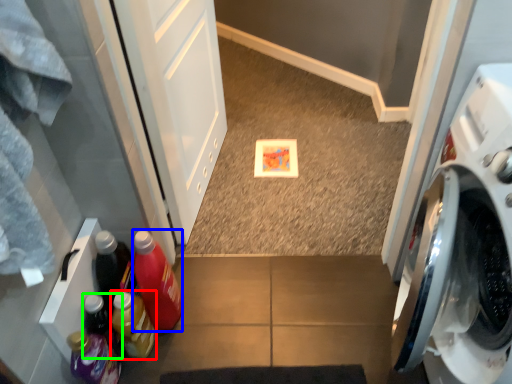
Question: Which object is positioned closest to bottle (highlighted by a red box)? Select from bottle (highlighted by a blue box) and bottle (highlighted by a green box).

Choices:
 (A) bottle
 (B) bottle

Answer: (B)